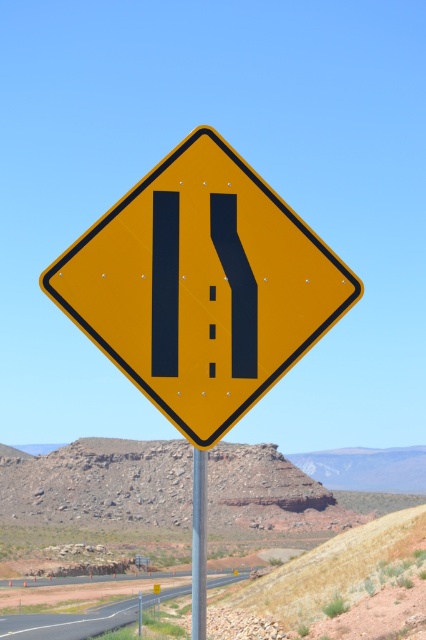
You are a driver approaching the yellow diamond road sign. You notice the asphalt road at lower center and the metallic silver pole at center. Which object appears taller in the image?

The asphalt road at lower center is much taller as metallic silver pole at center, so the asphalt road at lower center appears taller in the image.